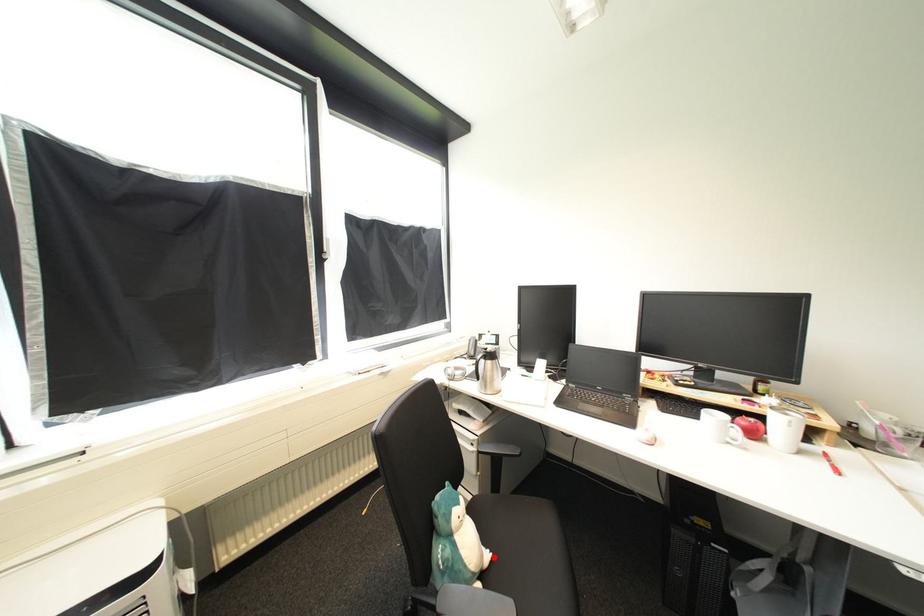
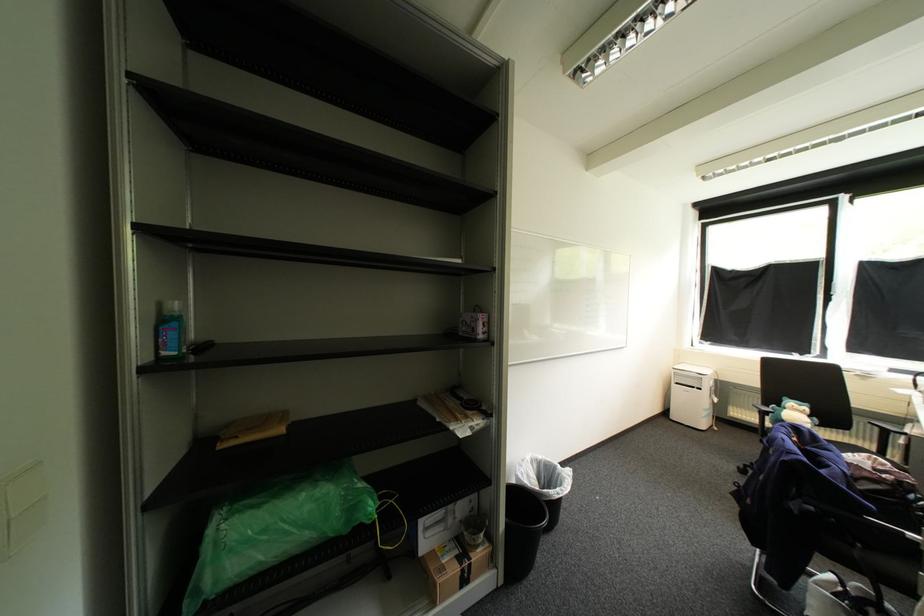
Question: I am providing you with two images of the same scene from different viewpoints. Given a red point in image1, look at the same physical point in image2. Is it:

Choices:
 (A) Closer to the viewpoint
 (B) Farther from the viewpoint

Answer: (B)